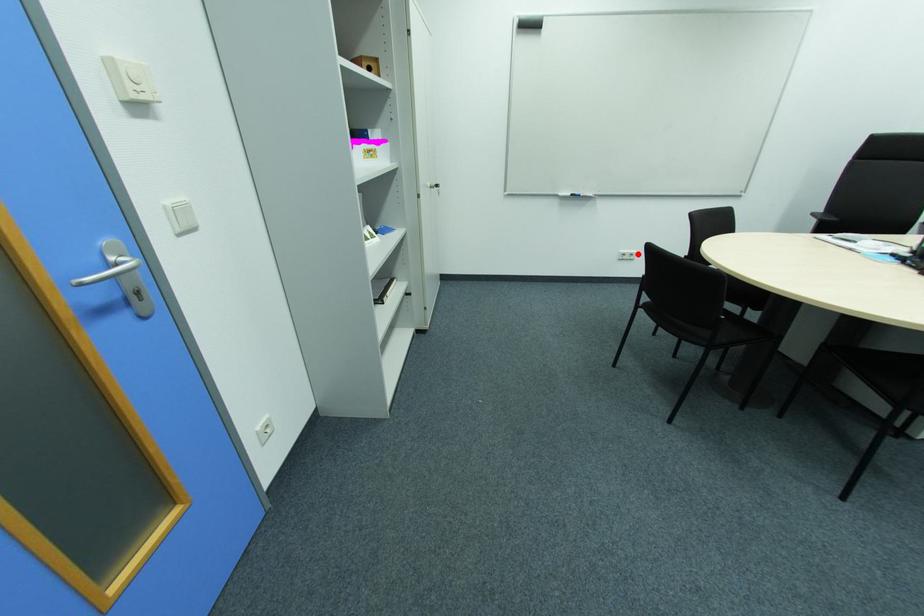
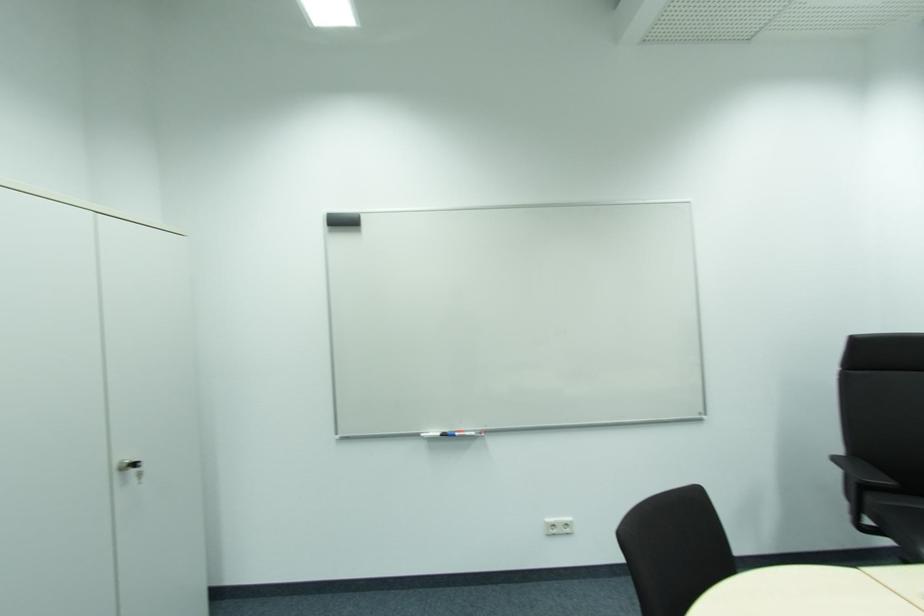
Question: I am providing you with two images of the same scene from different viewpoints. A red point is shown in image1. For the corresponding object point in image2, is it positioned nearer or farther from the camera?

Choices:
 (A) Nearer
 (B) Farther

Answer: (B)